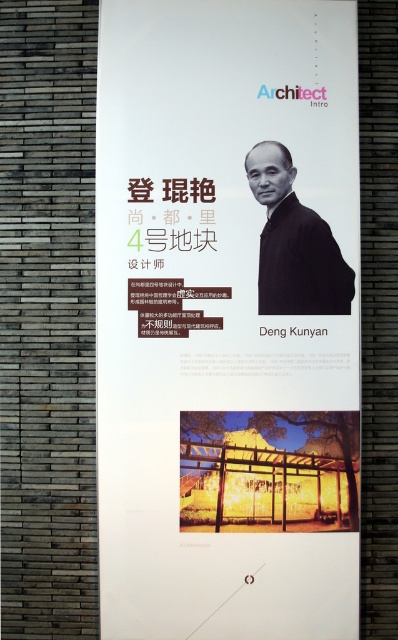
Question: Which object appears closest to the camera in this image?

Choices:
 (A) matte black portrait at upper center
 (B) black matte jacket at upper right

Answer: (A)

Question: Does matte black portrait at upper center appear on the left side of black matte jacket at upper right?

Choices:
 (A) yes
 (B) no

Answer: (A)

Question: Does matte black portrait at upper center appear on the left side of black matte jacket at upper right?

Choices:
 (A) no
 (B) yes

Answer: (B)

Question: Which point is closer to the camera taking this photo?

Choices:
 (A) (306, 227)
 (B) (218, 577)

Answer: (B)

Question: Does matte black portrait at upper center have a greater width compared to black matte jacket at upper right?

Choices:
 (A) yes
 (B) no

Answer: (A)